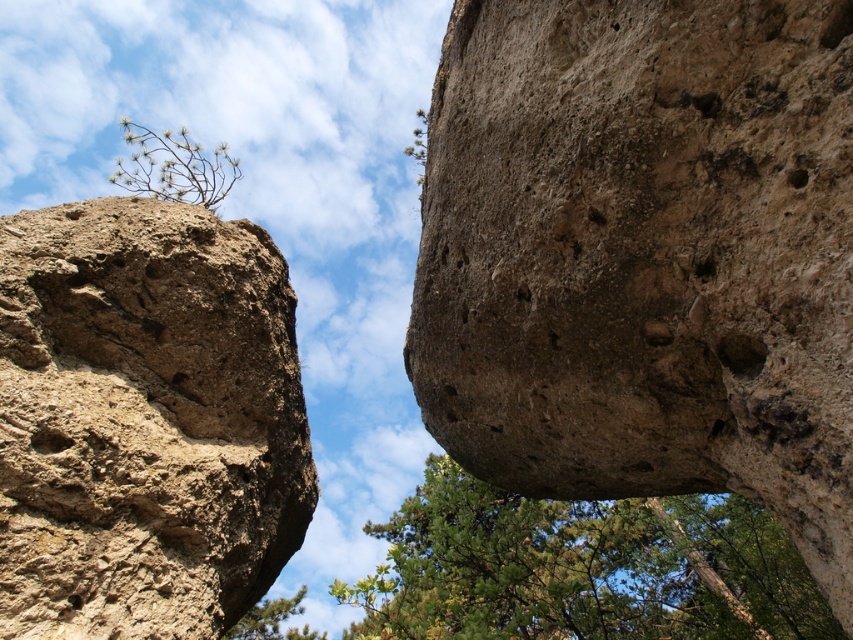
Question: Is brown rough rock at center thinner than green leafy tree at center?

Choices:
 (A) yes
 (B) no

Answer: (B)

Question: Which object appears closest to the camera in this image?

Choices:
 (A) brown rough rock at center
 (B) brown rough rock at upper left
 (C) green leafy tree at center
 (D) green leafy tree at upper left

Answer: (A)

Question: Which object is farther from the camera taking this photo?

Choices:
 (A) green leafy tree at center
 (B) brown rough rock at upper left

Answer: (A)

Question: Can you confirm if green leafy tree at center is bigger than green leafy tree at lower left?

Choices:
 (A) no
 (B) yes

Answer: (A)

Question: Which of the following is the closest to the observer?

Choices:
 (A) (244, 616)
 (B) (718, 422)
 (C) (175, 298)
 (D) (120, 157)

Answer: (B)

Question: Does brown rough rock at center have a larger size compared to green leafy tree at lower left?

Choices:
 (A) yes
 (B) no

Answer: (B)